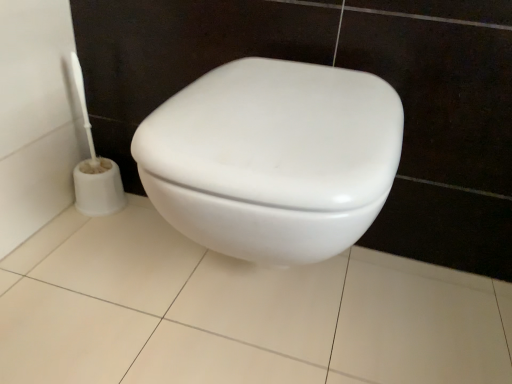
Locate an element on the screen. unoccupied region to the right of white glossy toilet at center is located at coordinates (420, 314).